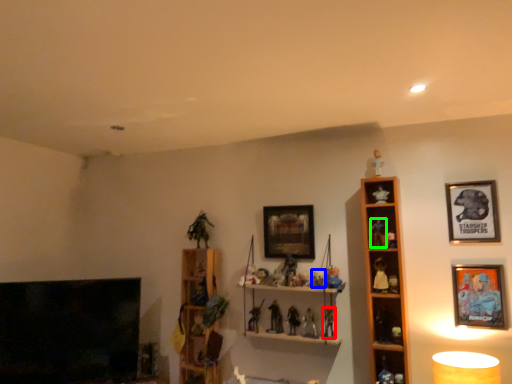
Question: Estimate the real-world distances between objects in this image. Which object is farther from toy (highlighted by a red box), toy (highlighted by a blue box) or toy (highlighted by a green box)?

Choices:
 (A) toy
 (B) toy

Answer: (B)